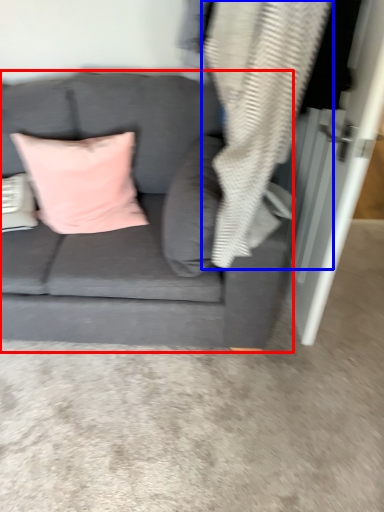
Question: Which of the following is the closest to the observer, studio couch (highlighted by a red box) or material (highlighted by a blue box)?

Choices:
 (A) studio couch
 (B) material

Answer: (B)